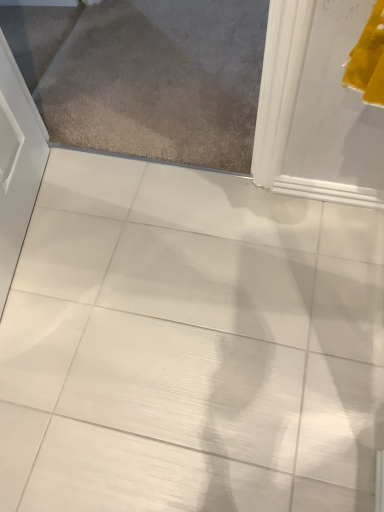
I want to click on vacant space situated above white glossy tile at center (from a real-world perspective), so (x=162, y=322).